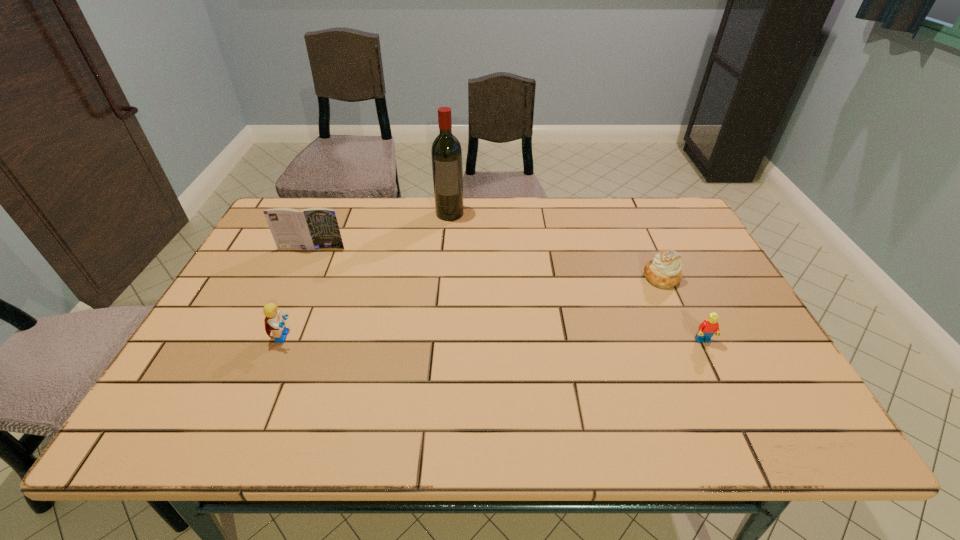
Find the location of `free space located on the front-facing side of the left Lego`. free space located on the front-facing side of the left Lego is located at coordinates (459, 336).

At what (x,y) coordinates should I click in order to perform the action: click on vacant region located on the front of the pastry. Please return your answer as a coordinate pair (x, y). The width and height of the screenshot is (960, 540). Looking at the image, I should click on (678, 312).

Find the location of a particular element. The width and height of the screenshot is (960, 540). free space located 0.120m on the face of the shorter Lego is located at coordinates (727, 390).

Image resolution: width=960 pixels, height=540 pixels. What are the coordinates of `object located at the far edge` in the screenshot? It's located at (446, 152).

You are a GUI agent. You are given a task and a screenshot of the screen. Output one action in this format:
    pyautogui.click(x=<x>, y=<y>)
    Task: Click on the object situated at the left edge
    The width and height of the screenshot is (960, 540).
    Given the screenshot: What is the action you would take?
    pyautogui.click(x=313, y=228)

Locate an element on the screen. pastry at the right edge is located at coordinates (664, 272).

Where is `Lego that is at the right edge`? The image size is (960, 540). Lego that is at the right edge is located at coordinates (709, 327).

In the image, there is a desktop. What are the coordinates of `vacant space at the far edge` in the screenshot? It's located at (466, 208).

This screenshot has height=540, width=960. Find the location of `free spot at the near edge of the desktop`. free spot at the near edge of the desktop is located at coordinates (549, 441).

Where is `blank space at the left edge`? Image resolution: width=960 pixels, height=540 pixels. blank space at the left edge is located at coordinates (252, 318).